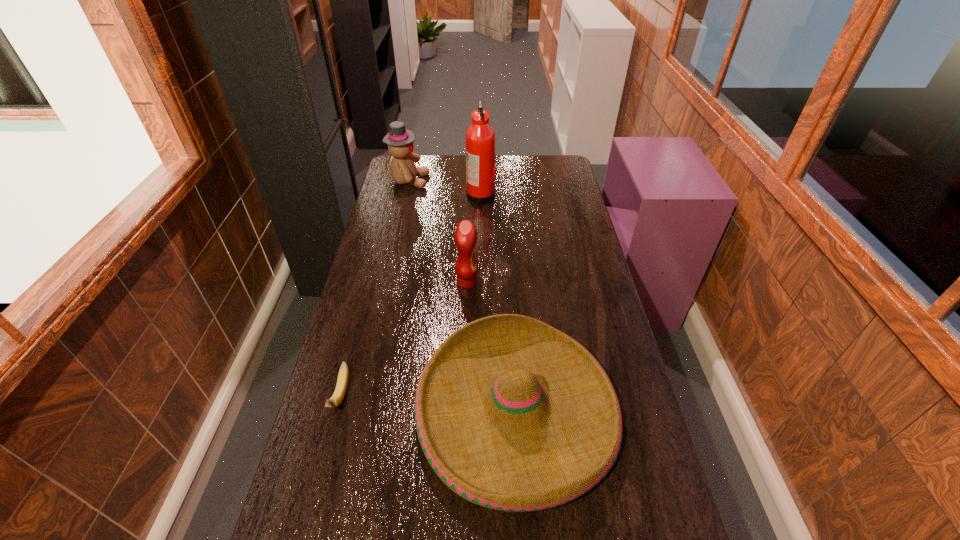
Find the location of `vacant point located 0.090m on the back of the second shortest object`. vacant point located 0.090m on the back of the second shortest object is located at coordinates (509, 312).

Find the location of a particular element. vacant area located at the stem of the banana is located at coordinates (311, 507).

This screenshot has width=960, height=540. In order to click on object present at the far edge in this screenshot , I will do `click(400, 141)`.

This screenshot has width=960, height=540. In order to click on rag_doll present at the left edge in this screenshot , I will do `click(400, 141)`.

The image size is (960, 540). What are the coordinates of `banana that is at the left edge` in the screenshot? It's located at (342, 381).

Where is `object that is positioned at the right edge`? object that is positioned at the right edge is located at coordinates tap(512, 414).

Locate an element on the screen. This screenshot has width=960, height=540. object at the far left corner is located at coordinates (400, 141).

Identify the location of vacant space at the far edge. The image size is (960, 540). (458, 165).

In the image, there is a desktop. In order to click on vacant space at the left edge in this screenshot , I will do `click(410, 228)`.

Image resolution: width=960 pixels, height=540 pixels. I want to click on free region at the right edge of the desktop, so click(568, 209).